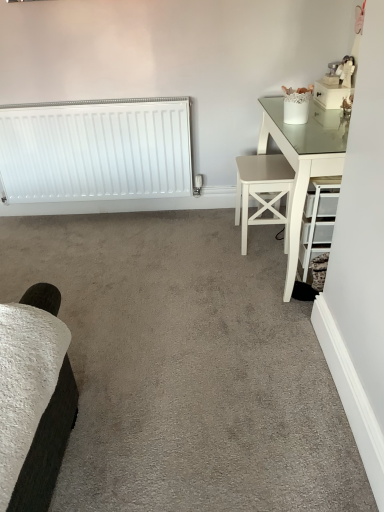
Identify the location of white wood stool at right. This screenshot has height=512, width=384. (262, 191).

What is the approximate height of white wood stool at right?

white wood stool at right is 17.59 inches tall.

Measure the distance between point [243,252] and camera.

Point [243,252] is 2.37 meters away from camera.

This screenshot has height=512, width=384. Describe the element at coordinates (262, 191) in the screenshot. I see `white wood stool at right` at that location.

What do you see at coordinates (96, 150) in the screenshot? I see `white matte radiator at left` at bounding box center [96, 150].

Find the location of a particular element. This screenshot has width=384, height=512. white matte radiator at left is located at coordinates (96, 150).

I want to click on white wood stool at right, so (262, 191).

Which object is positioned more to the right, white wood stool at right or white matte radiator at left?

white wood stool at right.

Which object is closer to the camera, white wood stool at right or white matte radiator at left?

white wood stool at right is more forward.

Is point (257, 224) behind point (48, 187)?

No, it is in front of (48, 187).

From the image's perspective, who appears lower, white wood stool at right or white matte radiator at left?

white wood stool at right, from the image's perspective.

From a real-world perspective, is white wood stool at right on white matte radiator at left?

No, from a real-world perspective, white wood stool at right is not over white matte radiator at left

Does white wood stool at right have a lesser width compared to white matte radiator at left?

No, white wood stool at right is not thinner than white matte radiator at left.

Considering the sizes of white wood stool at right and white matte radiator at left in the image, is white wood stool at right taller or shorter than white matte radiator at left?

In the image, white wood stool at right appears to be shorter than white matte radiator at left.

Who is smaller, white wood stool at right or white matte radiator at left?

With smaller size is white wood stool at right.

Can we say white wood stool at right lies outside white matte radiator at left?

Yes.

Looking at this image, is white wood stool at right far from white matte radiator at left?

No, white wood stool at right is in close proximity to white matte radiator at left.

Does white wood stool at right turn towards white matte radiator at left?

No, white wood stool at right is not turned towards white matte radiator at left.

Measure the distance from white wood stool at right to white matte radiator at left.

A distance of 30.74 inches exists between white wood stool at right and white matte radiator at left.

Locate an element on the screen. The height and width of the screenshot is (512, 384). radiator positioned vertically above the white wood stool at right (from a real-world perspective) is located at coordinates (96, 150).

Which object is positioned more to the right, white matte radiator at left or white wood stool at right?

white wood stool at right is more to the right.

Does white matte radiator at left come in front of white wood stool at right?

No, it is not.

Consider the image. Which is further, (115, 184) or (264, 165)?

Positioned behind is point (115, 184).

From the image's perspective, is white matte radiator at left above or below white wood stool at right?

white matte radiator at left is situated higher than white wood stool at right in the image.

From a real-world perspective, between white matte radiator at left and white wood stool at right, who is vertically lower?

In real-world perspective, white wood stool at right is lower.

Considering the relative sizes of white matte radiator at left and white wood stool at right in the image provided, is white matte radiator at left thinner than white wood stool at right?

Correct, the width of white matte radiator at left is less than that of white wood stool at right.

Can you confirm if white matte radiator at left is taller than white wood stool at right?

Indeed, white matte radiator at left has a greater height compared to white wood stool at right.

Considering the relative sizes of white matte radiator at left and white wood stool at right in the image provided, is white matte radiator at left smaller than white wood stool at right?

Actually, white matte radiator at left might be larger than white wood stool at right.

Based on the photo, is white wood stool at right completely or partially inside white matte radiator at left?

No, white wood stool at right is not inside white matte radiator at left.

Can you see white matte radiator at left touching white wood stool at right?

No.

Is white matte radiator at left looking in the opposite direction of white wood stool at right?

white matte radiator at left does not have its back to white wood stool at right.

What are the coordinates of `stool below the white matte radiator at left (from the image's perspective)` in the screenshot? It's located at (262, 191).

Locate an element on the screen. This screenshot has height=512, width=384. stool below the white matte radiator at left (from the image's perspective) is located at coordinates (262, 191).

This screenshot has width=384, height=512. In order to click on stool on the right of white matte radiator at left in this screenshot , I will do `click(262, 191)`.